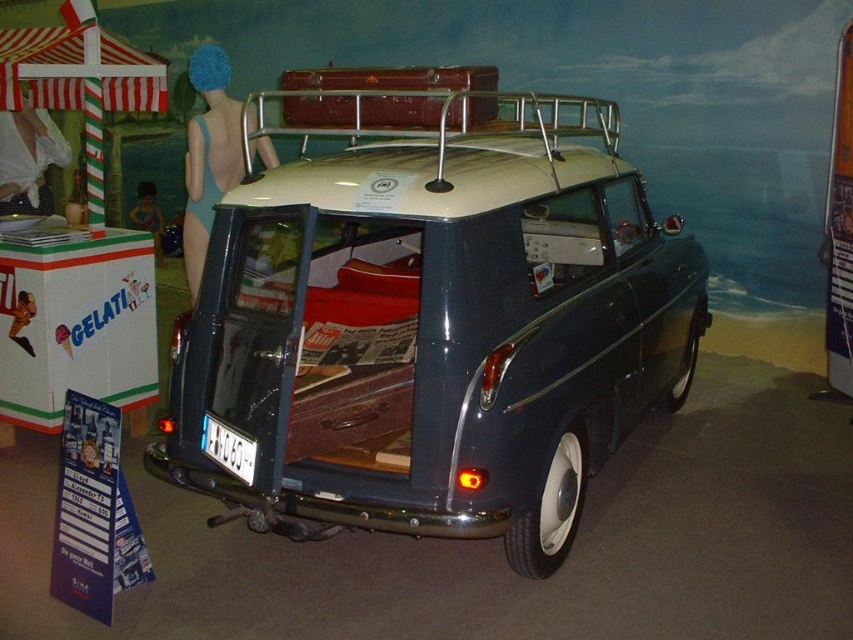
Question: Which point appears closest to the camera in this image?

Choices:
 (A) (158, 228)
 (B) (477, 202)

Answer: (B)

Question: Can you confirm if blue swimsuit at left is bigger than blue fabric swimsuit at upper left?

Choices:
 (A) yes
 (B) no

Answer: (A)

Question: Which point appears closest to the camera in this image?

Choices:
 (A) (149, 200)
 (B) (241, 173)
 (C) (646, 333)

Answer: (C)

Question: Does shiny dark blue van at center appear over blue swimsuit at left?

Choices:
 (A) yes
 (B) no

Answer: (B)

Question: Which is nearer to the shiny dark blue van at center?

Choices:
 (A) blue fabric swimsuit at upper left
 (B) blue swimsuit at left

Answer: (B)

Question: Is shiny dark blue van at center smaller than blue swimsuit at left?

Choices:
 (A) no
 (B) yes

Answer: (A)